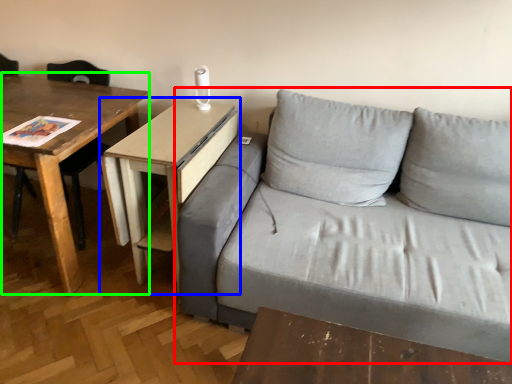
Question: Which object is the closest to the studio couch (highlighted by a red box)? Choose among these: table (highlighted by a blue box) or table (highlighted by a green box).

Choices:
 (A) table
 (B) table

Answer: (A)